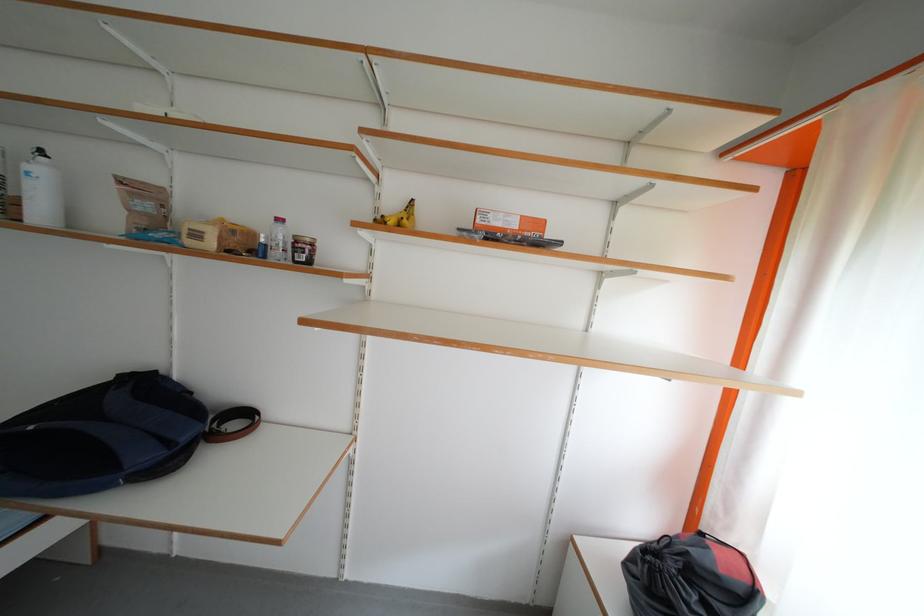
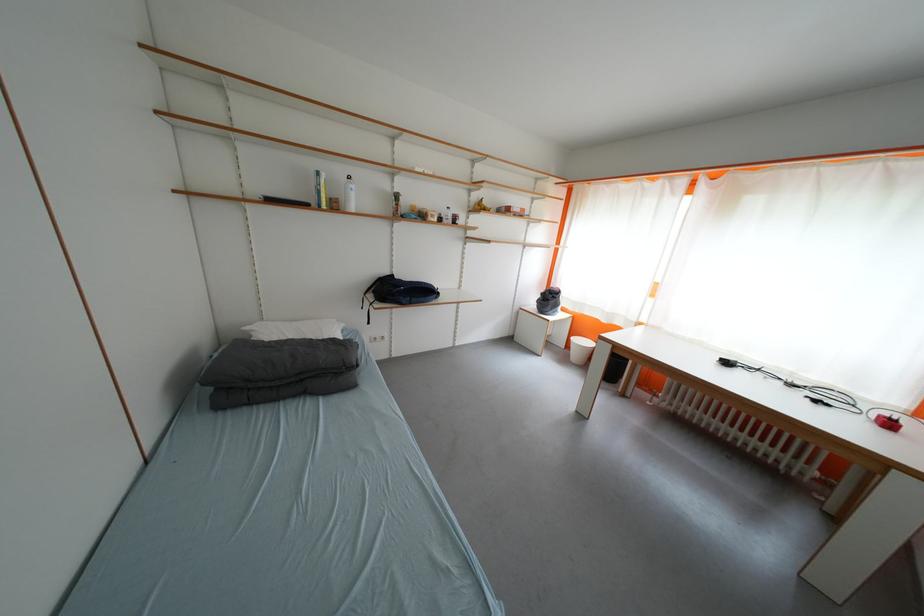
Locate, in the second image, the point that corresponds to [380,269] in the first image.

(476, 225)